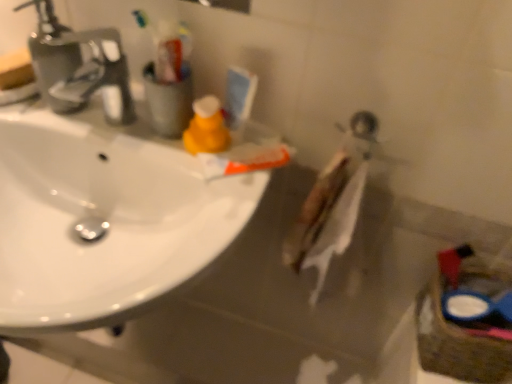
Question: Are matte orange spray bottle at upper center and white glossy sink at upper left beside each other?

Choices:
 (A) yes
 (B) no

Answer: (B)

Question: Is matte orange spray bottle at upper center facing away from white glossy sink at upper left?

Choices:
 (A) no
 (B) yes

Answer: (A)

Question: Is matte orange spray bottle at upper center taller than white glossy sink at upper left?

Choices:
 (A) yes
 (B) no

Answer: (B)

Question: Does matte orange spray bottle at upper center contain white glossy sink at upper left?

Choices:
 (A) no
 (B) yes

Answer: (A)

Question: Can you confirm if matte orange spray bottle at upper center is wider than white glossy sink at upper left?

Choices:
 (A) no
 (B) yes

Answer: (A)

Question: Is matte orange spray bottle at upper center facing towards white glossy sink at upper left?

Choices:
 (A) no
 (B) yes

Answer: (A)

Question: Is matte orange spray bottle at upper center oriented towards white matte toothpaste at center?

Choices:
 (A) no
 (B) yes

Answer: (A)

Question: Is matte orange spray bottle at upper center touching white matte toothpaste at center?

Choices:
 (A) no
 (B) yes

Answer: (B)

Question: Is matte orange spray bottle at upper center shorter than white matte toothpaste at center?

Choices:
 (A) no
 (B) yes

Answer: (A)

Question: Is matte orange spray bottle at upper center positioned with its back to white matte toothpaste at center?

Choices:
 (A) no
 (B) yes

Answer: (A)

Question: From the image's perspective, is matte orange spray bottle at upper center located beneath white matte toothpaste at center?

Choices:
 (A) yes
 (B) no

Answer: (B)

Question: Does matte orange spray bottle at upper center appear on the right side of white matte toothpaste at center?

Choices:
 (A) no
 (B) yes

Answer: (A)

Question: Is white matte toothpaste at center to the left of matte orange spray bottle at upper center from the viewer's perspective?

Choices:
 (A) yes
 (B) no

Answer: (B)